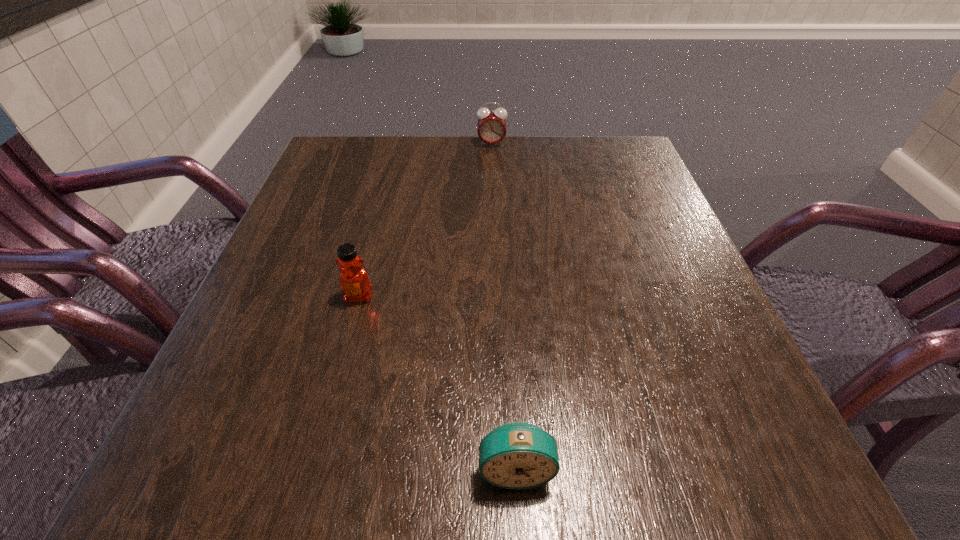
Find the location of a particular element. free space at the left edge of the desktop is located at coordinates (308, 246).

In the image, there is a desktop. Where is `vacant region at the right edge`? vacant region at the right edge is located at coordinates (721, 337).

In the image, there is a desktop. Where is `vacant space at the near left corner`? The width and height of the screenshot is (960, 540). vacant space at the near left corner is located at coordinates (231, 489).

What are the coordinates of `vacant space at the far right corner of the desktop` in the screenshot? It's located at (613, 157).

You are a GUI agent. You are given a task and a screenshot of the screen. Output one action in this format:
    pyautogui.click(x=<x>, y=<y>)
    Task: Click on the unoccupied position between the honey and the farthest object
    
    Given the screenshot: What is the action you would take?
    pyautogui.click(x=425, y=220)

Identify the location of free space between the nearest object and the second nearest object. (438, 382).

Find the location of a particular element. free area in between the second nearest object and the farthest object is located at coordinates (425, 220).

What are the coordinates of `vacant point located between the farther alarm clock and the second nearest object` in the screenshot? It's located at (425, 220).

Locate an element on the screen. The height and width of the screenshot is (540, 960). vacant area that lies between the leftmost object and the farthest object is located at coordinates (425, 220).

Find the location of a particular element. This screenshot has width=960, height=540. vacant area that lies between the farther alarm clock and the nearest object is located at coordinates (504, 306).